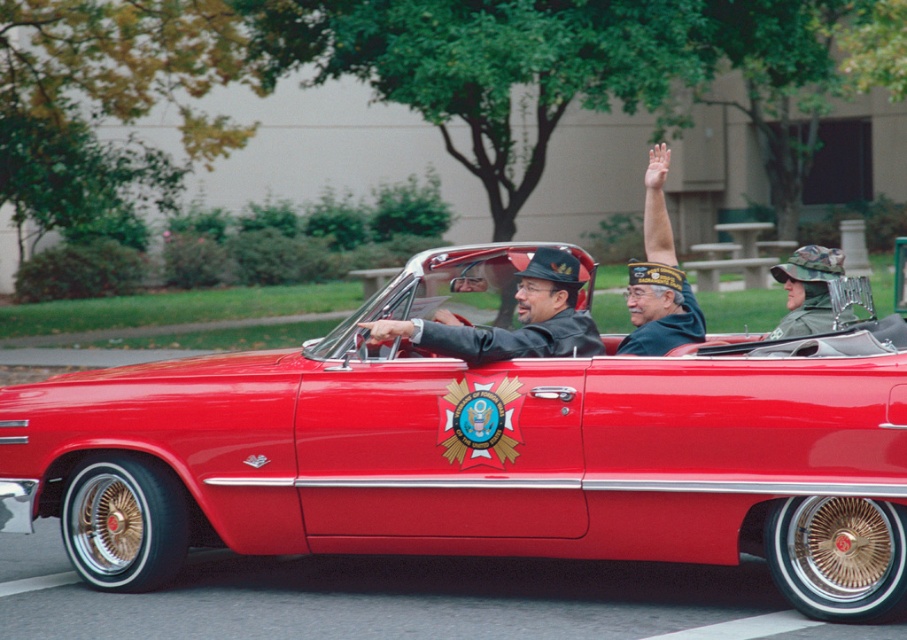
You are a photographer trying to capture the shiny red car at center and the shiny black hat at center in a single frame. Based on their sizes, which object will appear larger in the photo?

The shiny red car at center will appear larger in the photo because its width surpasses that of the shiny black hat at center.

You are standing in the park and see the shiny red car at center and the green felt hat at upper center. Which object is positioned higher from the ground?

The green felt hat at upper center is positioned higher from the ground than the shiny red car at center.

Looking at this image, you are a photographer trying to capture a clear photo of both the shiny black hat at center and the green felt hat at upper center. Since you want to ensure both hats are visible in the frame, which hat should you adjust your focus on first to account for their sizes?

The shiny black hat at center is smaller than the green felt hat at upper center. To ensure both are visible, focus on the smaller shiny black hat at center first to properly frame it before adjusting for the larger green felt hat at upper center.